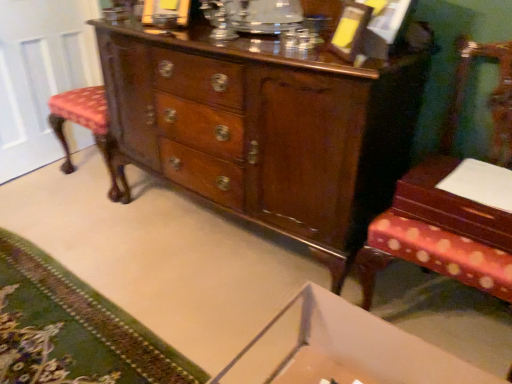
At what (x,y) coordinates should I click in order to perform the action: click on white cardboard changing table at lower center. Please return your answer as a coordinate pair (x, y). This screenshot has width=512, height=384. Looking at the image, I should click on (342, 349).

Identify the location of wooden chair with patterned cushion at right. (450, 201).

This screenshot has width=512, height=384. What do you see at coordinates (73, 329) in the screenshot? I see `green carpet at lower left` at bounding box center [73, 329].

I want to click on mahogany wood table at right, so click(x=449, y=205).

Between point (161, 380) and point (496, 231), which one is positioned behind?

Positioned behind is point (161, 380).

Is there a large distance between green carpet at lower left and mahogany wood table at right?

Yes, green carpet at lower left and mahogany wood table at right are located far from each other.

From a real-world perspective, is green carpet at lower left positioned over mahogany wood table at right based on gravity?

No.

Is green carpet at lower left taller than mahogany wood table at right?

In fact, green carpet at lower left may be shorter than mahogany wood table at right.

Which object is positioned more to the left, green carpet at lower left or shiny brown wood chest of drawers at center?

From the viewer's perspective, green carpet at lower left appears more on the left side.

Does green carpet at lower left turn towards shiny brown wood chest of drawers at center?

Yes, green carpet at lower left is oriented towards shiny brown wood chest of drawers at center.

Can you confirm if green carpet at lower left is wider than shiny brown wood chest of drawers at center?

In fact, green carpet at lower left might be narrower than shiny brown wood chest of drawers at center.

Is green carpet at lower left not close to shiny brown wood chest of drawers at center?

No, there isn't a large distance between green carpet at lower left and shiny brown wood chest of drawers at center.

Based on the photo, can shiny brown wood chest of drawers at center be found inside white glossy door at left?

That's incorrect, shiny brown wood chest of drawers at center is not inside white glossy door at left.

Can you confirm if white glossy door at left is thinner than shiny brown wood chest of drawers at center?

Yes, white glossy door at left is thinner than shiny brown wood chest of drawers at center.

Does white glossy door at left lie in front of shiny brown wood chest of drawers at center?

No.

From the image's perspective, is white glossy door at left located beneath shiny brown wood chest of drawers at center?

No, from the image's perspective, white glossy door at left is not below shiny brown wood chest of drawers at center.

Is green carpet at lower left positioned behind wooden chair with patterned cushion at right?

Yes, the depth of green carpet at lower left is greater than that of wooden chair with patterned cushion at right.

From a real-world perspective, is green carpet at lower left physically below wooden chair with patterned cushion at right?

Yes.

Does point (55, 353) appear closer or farther from the camera than point (365, 276)?

Point (55, 353) appears to be farther away from the viewer than point (365, 276).

Is white cardboard changing table at lower center looking in the opposite direction of green carpet at lower left?

That's not correct — white cardboard changing table at lower center is not looking away from green carpet at lower left.

Is green carpet at lower left completely or partially inside white cardboard changing table at lower center?

No, green carpet at lower left is not a part of white cardboard changing table at lower center.

In the image, there is a white cardboard changing table at lower center. Where is `mat below it (from a real-world perspective)`? The height and width of the screenshot is (384, 512). mat below it (from a real-world perspective) is located at coordinates [x=73, y=329].

From a real-world perspective, is white cardboard changing table at lower center positioned above or below green carpet at lower left?

white cardboard changing table at lower center is above green carpet at lower left.

Which of these two, shiny brown wood chest of drawers at center or white cardboard changing table at lower center, is thinner?

With smaller width is white cardboard changing table at lower center.

Where is `changing table on the right side of shiny brown wood chest of drawers at center`? Image resolution: width=512 pixels, height=384 pixels. changing table on the right side of shiny brown wood chest of drawers at center is located at coordinates (342, 349).

From the image's perspective, is white cardboard changing table at lower center on white glossy door at left?

No, from the image's perspective, white cardboard changing table at lower center is not on top of white glossy door at left.

Locate an element on the screen. The image size is (512, 384). door on the left of white cardboard changing table at lower center is located at coordinates (40, 75).

Would you consider white cardboard changing table at lower center to be distant from white glossy door at left?

Yes, white cardboard changing table at lower center and white glossy door at left are quite far apart.

The height and width of the screenshot is (384, 512). What are the coordinates of `mat below the mahogany wood table at right (from a real-world perspective)` in the screenshot? It's located at (73, 329).

At what (x,y) coordinates should I click in order to perform the action: click on the chest of drawers located above the green carpet at lower left (from the image's perspective). Please return your answer as a coordinate pair (x, y). Looking at the image, I should click on (265, 129).

Which object lies further to the anchor point mahogany wood table at right, white cardboard changing table at lower center or wooden chair with patterned cushion at right?

white cardboard changing table at lower center is positioned further to the anchor mahogany wood table at right.

From the image, which object appears to be nearer to wooden chair with patterned cushion at right, mahogany wood table at right or white cardboard changing table at lower center?

Among the two, mahogany wood table at right is located nearer to wooden chair with patterned cushion at right.

Based on their spatial positions, is mahogany wood table at right or white glossy door at left further from shiny brown wood chest of drawers at center?

white glossy door at left is positioned further to the anchor shiny brown wood chest of drawers at center.

Looking at the image, which one is located further to wooden chair with patterned cushion at right, mahogany wood table at right or white glossy door at left?

white glossy door at left.

Based on their spatial positions, is white glossy door at left or green carpet at lower left closer to mahogany wood table at right?

green carpet at lower left is positioned closer to the anchor mahogany wood table at right.

From the image, which object appears to be nearer to mahogany wood table at right, green carpet at lower left or white cardboard changing table at lower center?

white cardboard changing table at lower center lies closer to mahogany wood table at right than the other object.

Considering their positions, is wooden chair with patterned cushion at right positioned further to white glossy door at left than mahogany wood table at right?

Based on the image, mahogany wood table at right appears to be further to white glossy door at left.

Estimate the real-world distances between objects in this image. Which object is closer to white cardboard changing table at lower center, mahogany wood table at right or shiny brown wood chest of drawers at center?

Among the two, mahogany wood table at right is located nearer to white cardboard changing table at lower center.

Where is `mat situated between white glossy door at left and white cardboard changing table at lower center from left to right`? The width and height of the screenshot is (512, 384). mat situated between white glossy door at left and white cardboard changing table at lower center from left to right is located at coordinates (73, 329).

Find the location of a particular element. the chest of drawers located between green carpet at lower left and wooden chair with patterned cushion at right in the left-right direction is located at coordinates (265, 129).

You are a GUI agent. You are given a task and a screenshot of the screen. Output one action in this format:
    pyautogui.click(x=<x>, y=<y>)
    Task: Click on the changing table between white glossy door at left and wooden chair with patterned cushion at right
    
    Given the screenshot: What is the action you would take?
    pyautogui.click(x=342, y=349)

This screenshot has height=384, width=512. I want to click on chest of drawers between green carpet at lower left and white cardboard changing table at lower center in the horizontal direction, so click(265, 129).